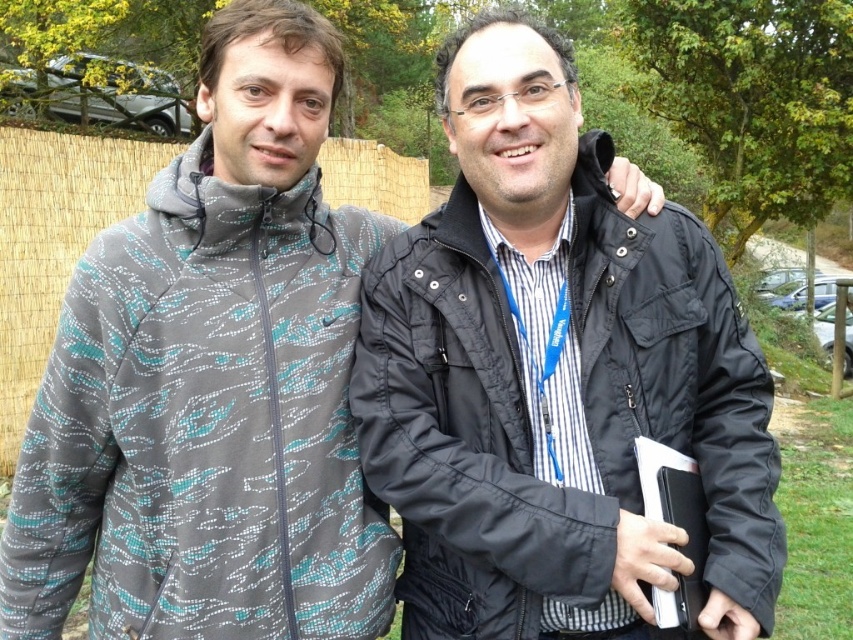
You are planning to take a photo of both the gray printed jacket at left and the black quilted jacket at center. Based on their sizes, which jacket should you focus on first to ensure it fits within the frame?

The gray printed jacket at left is taller than the black quilted jacket at center, so you should focus on the gray printed jacket at left first to ensure it fits within the frame since it is larger in height.

You are standing in a park and see the gray printed jacket at left. If you want to walk directly towards it, which direction should you move relative to your current position?

Since the gray printed jacket at left is positioned at point 0.669 on the x and 0.240 on the y coordinate, you should move towards the left and slightly forward to reach it.